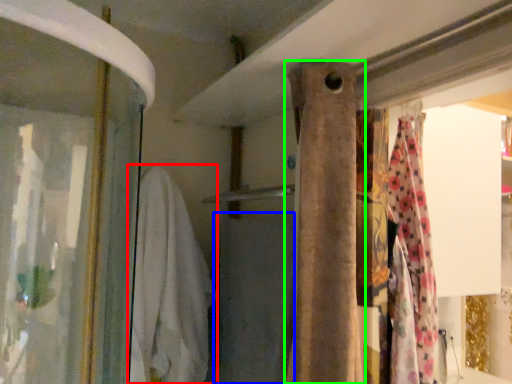
Question: Which is farther away from clothing (highlighted by a red box)? bath towel (highlighted by a blue box) or curtain (highlighted by a green box)?

Choices:
 (A) bath towel
 (B) curtain

Answer: (B)